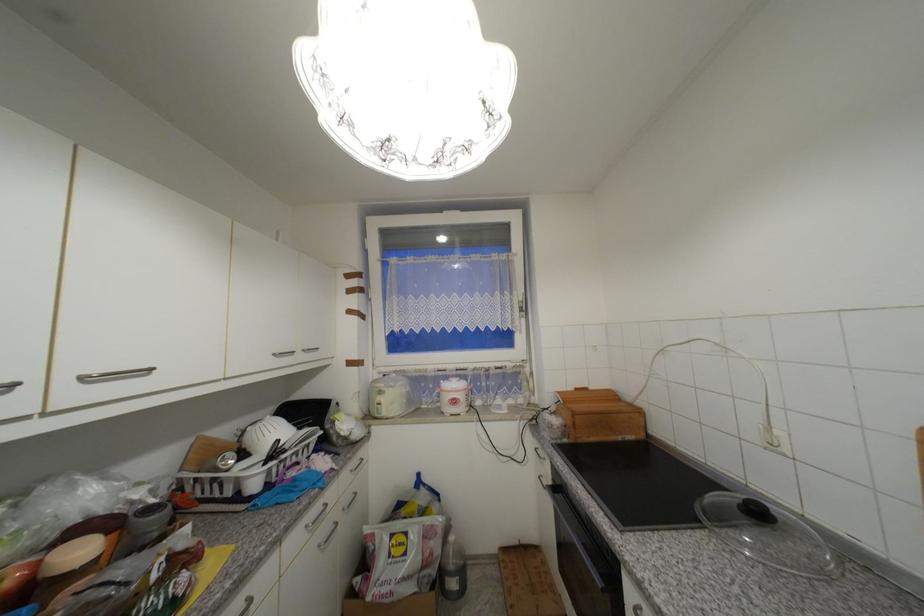
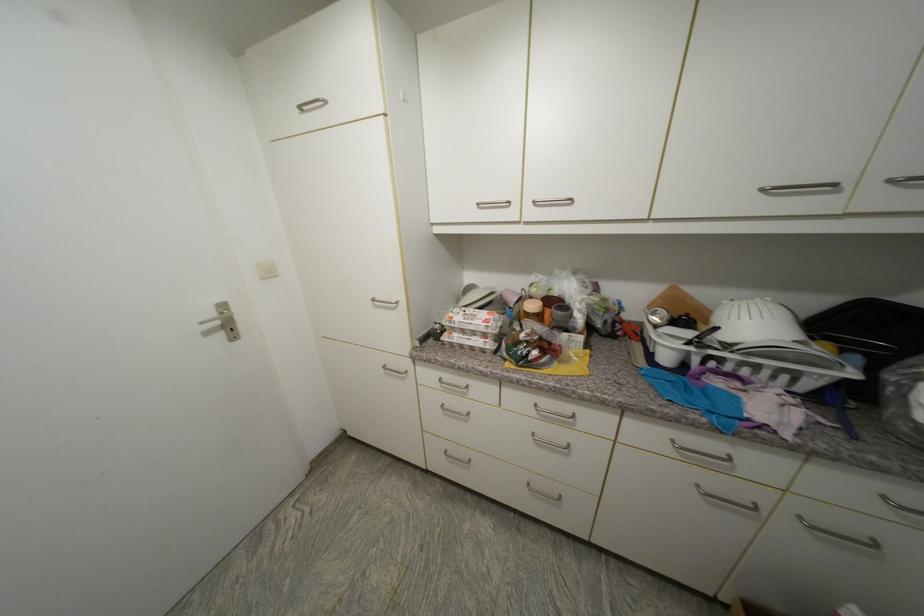
The first image is from the beginning of the video and the second image is from the end. How did the camera likely rotate when shooting the video?

The camera's rotation is toward left-down.